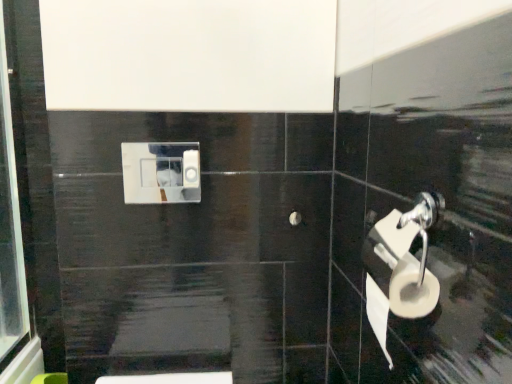
Question: Is point (393, 289) closer or farther from the camera than point (184, 160)?

Choices:
 (A) farther
 (B) closer

Answer: (B)

Question: Is white matte toilet paper at right, which is the second toilet paper in top-to-bottom order, spatially inside white plastic toilet paper at center, which is counted as the 1th toilet paper, starting from the left, or outside of it?

Choices:
 (A) inside
 (B) outside

Answer: (B)

Question: In terms of height, does white matte toilet paper at right, which is counted as the second toilet paper, starting from the left, look taller or shorter compared to white plastic toilet paper at center, which is the second toilet paper from right to left?

Choices:
 (A) tall
 (B) short

Answer: (A)

Question: From the image's perspective, is white plastic toilet paper at center, which ranks as the 2th toilet paper in bottom-to-top order, located above or below white matte toilet paper at right, which is counted as the 2th toilet paper, starting from the back?

Choices:
 (A) above
 (B) below

Answer: (A)

Question: In terms of height, does white plastic toilet paper at center, which is the second toilet paper from right to left, look taller or shorter compared to white matte toilet paper at right, which is the 1th toilet paper from front to back?

Choices:
 (A) tall
 (B) short

Answer: (B)

Question: Is white plastic toilet paper at center, positioned as the 1th toilet paper in back-to-front order, in front of or behind white matte toilet paper at right, which is counted as the second toilet paper, starting from the left, in the image?

Choices:
 (A) front
 (B) behind

Answer: (B)

Question: Considering the positions of white plastic toilet paper at center, which is counted as the 1th toilet paper, starting from the left, and white matte toilet paper at right, which is the 1th toilet paper from front to back, in the image, is white plastic toilet paper at center, which is counted as the 1th toilet paper, starting from the left, wider or thinner than white matte toilet paper at right, which is the 1th toilet paper from front to back,?

Choices:
 (A) thin
 (B) wide

Answer: (A)